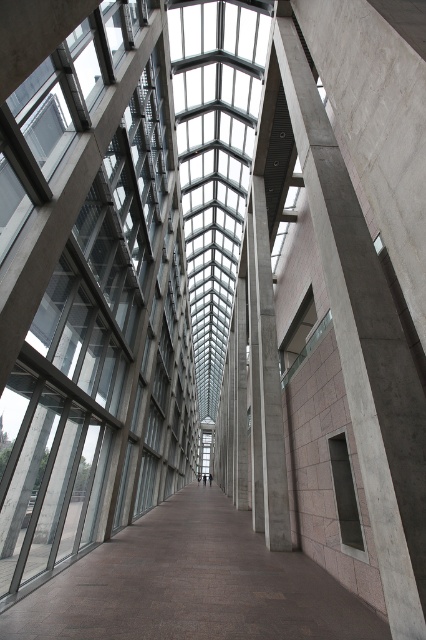
You are a delivery person carrying a tall package that is 2 meters in height. You enter the corridor and see the smooth concrete floor at center and the concrete pillar at center. Can you safely pass through the corridor without hitting the top of your package on any objects?

The smooth concrete floor at center is not as tall as concrete pillar at center. Since the pillar is taller than the floor, and your package is 2 meters tall, you need to ensure that the height of the corridor is sufficient. However, the description does not provide specific measurements for the pillar or the corridor height. Therefore, it is uncertain if the package will clear the height restriction.

You are standing at the entrance of the corridor and want to walk towards the smooth concrete floor at center. However, there is a concrete pillar at center in your path. Based on the scene description, can you walk around the pillar to reach the floor?

The smooth concrete floor at center is closer to the viewer than the concrete pillar at center, meaning the floor is in front of the pillar. Since the pillar is behind the floor, you can walk directly to the floor without needing to go around the pillar.